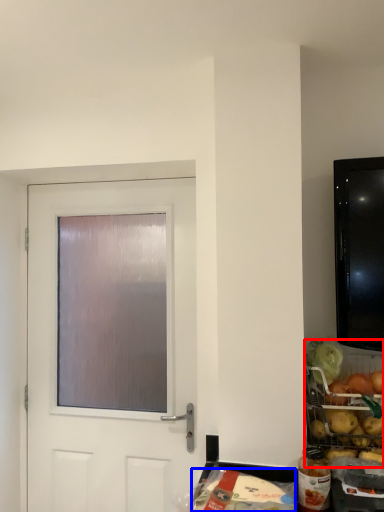
Question: Which object is further to the camera taking this photo, food (highlighted by a red box) or food (highlighted by a blue box)?

Choices:
 (A) food
 (B) food

Answer: (A)